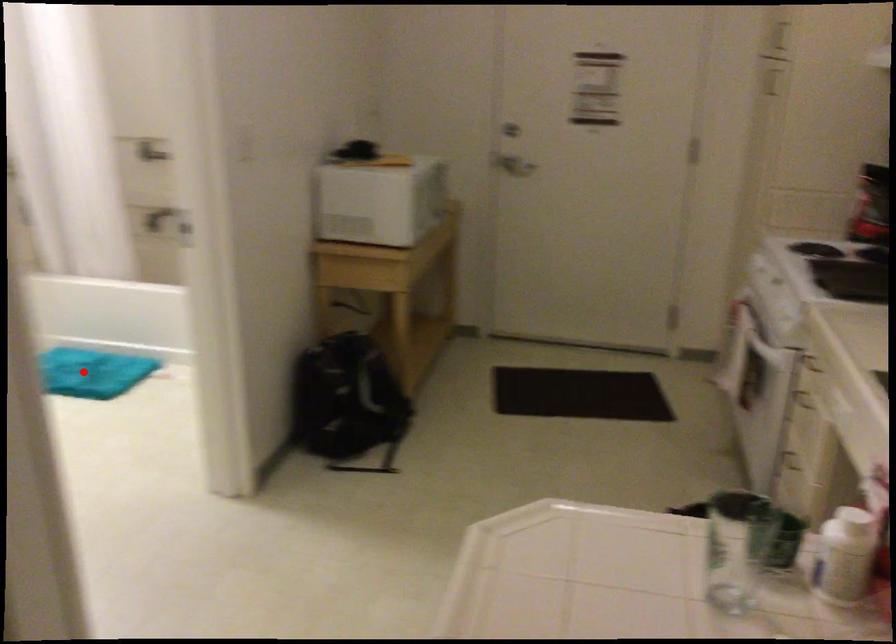
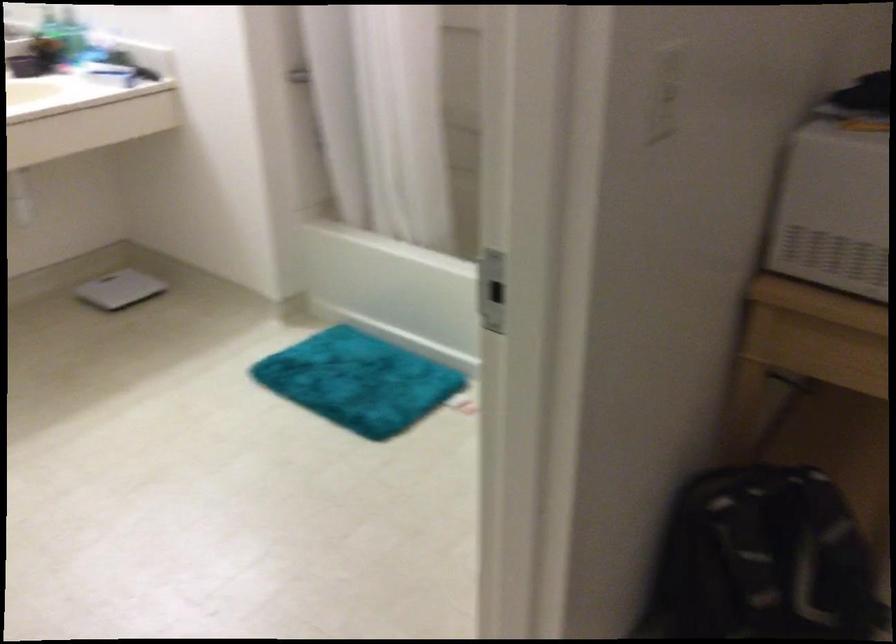
In the second image, find the point that corresponds to the highlighted location in the first image.

(358, 381)